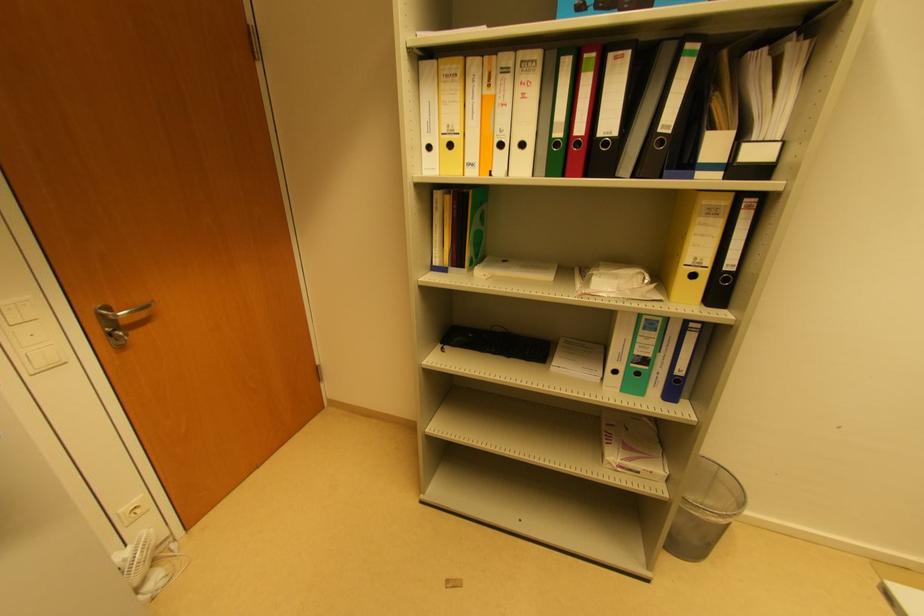
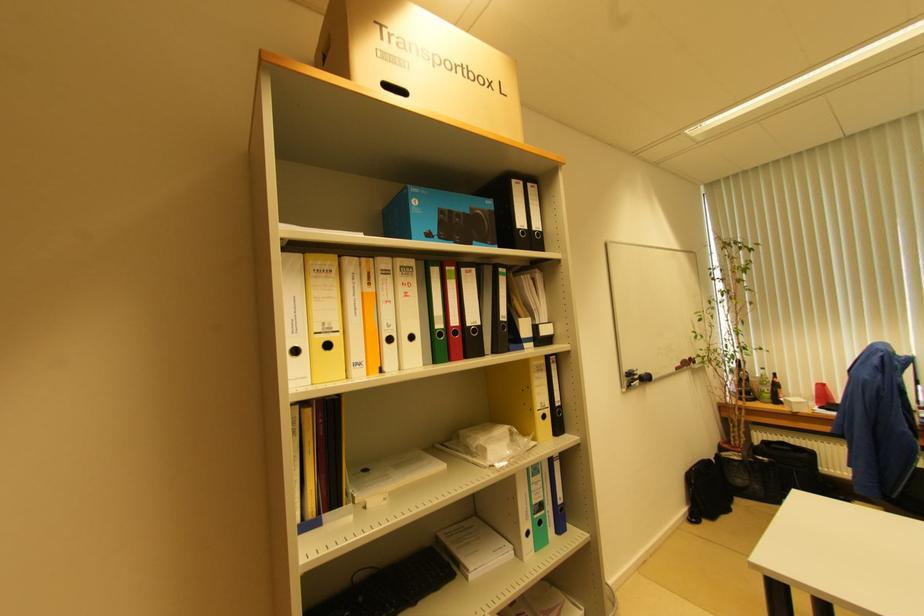
The first image is from the beginning of the video and the second image is from the end. How did the camera likely rotate when shooting the video?

The camera rotated toward right-up.